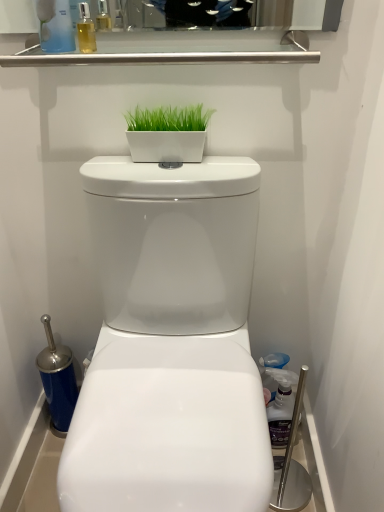
Question: From the image's perspective, is white glossy toilet at center above or below translucent plastic spray bottle at right, which ranks as the first cleaning product in right-to-left order?

Choices:
 (A) above
 (B) below

Answer: (A)

Question: Considering the positions of point (210, 336) and point (269, 410), is point (210, 336) closer or farther from the camera than point (269, 410)?

Choices:
 (A) closer
 (B) farther

Answer: (A)

Question: Which object is positioned farthest from the translucent plastic spray bottle at right, which ranks as the first cleaning product in right-to-left order?

Choices:
 (A) green matte planter at center
 (B) white glossy toilet at center
 (C) translucent plastic bottle at upper left, which is the 1th cleaning product in front-to-back order

Answer: (C)

Question: Which object is positioned farthest from the translucent plastic bottle at upper left, which is the 1th cleaning product in front-to-back order?

Choices:
 (A) green matte planter at center
 (B) white glossy toilet at center
 (C) translucent plastic spray bottle at right, acting as the 1th cleaning product starting from the bottom

Answer: (C)